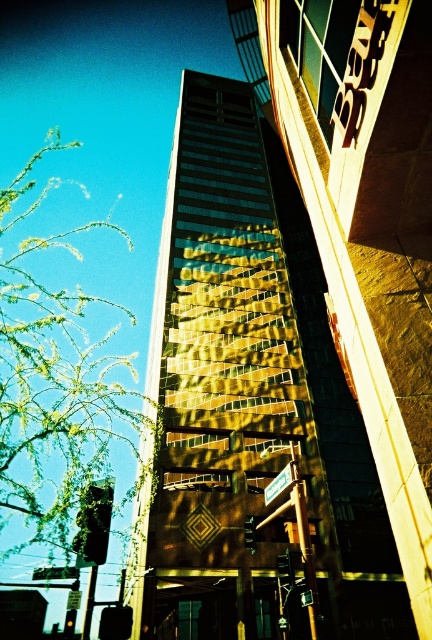
You are an architect analyzing the building and the tree in the image. From your viewpoint, which object is closer to you, the gold reflective glass building at center or the green leafy branches at left?

The gold reflective glass building at center is closer to you because the green leafy branches at left is behind it.

Based on the photo, you are an urban planner analyzing the space between the gold reflective glass building at center and the green leafy branches at left. Given that the building is narrower than the branches, how does this affect the potential for sunlight reaching the area between them?

The gold reflective glass building at center is narrower than the green leafy branches at left, so the area between them may receive more sunlight as the building does not block as much light as the wider branches would.

You are standing in front of the modern building and want to determine the relative positions of two points marked on the facade. Which point, point [149,339] or point [22,396], is closer to you?

Point [149,339] is closer to you because it is further to the viewer than point [22,396].